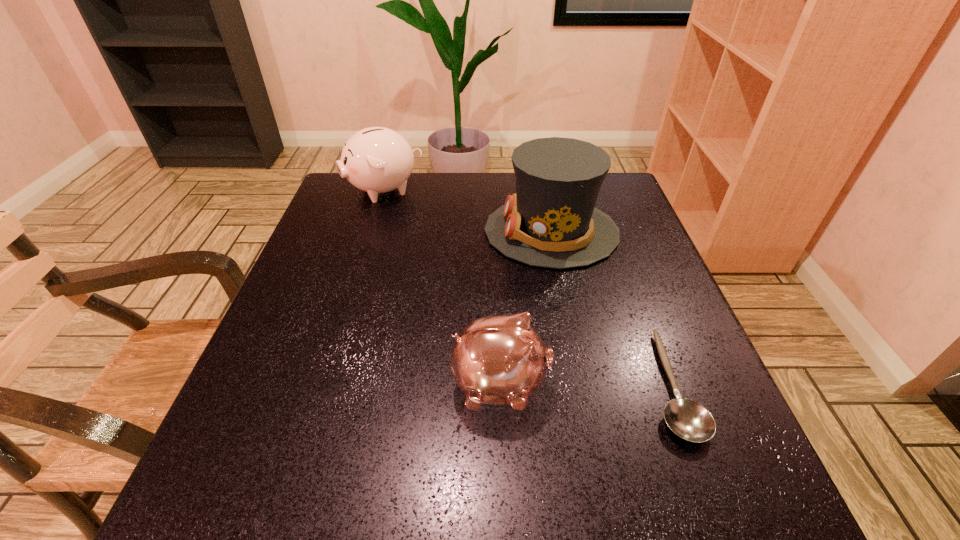
At what (x,y) coordinates should I click in order to perform the action: click on blank space that satisfies the following two spatial constraints: 1. with goggles on the front of the ladle; 2. on the left side of the dress hat. Please return your answer as a coordinate pair (x, y). The height and width of the screenshot is (540, 960). Looking at the image, I should click on click(583, 385).

Find the location of a particular element. vacant area that satisfies the following two spatial constraints: 1. on the front side of the shortest object; 2. on the right side of the leftmost object is located at coordinates (324, 385).